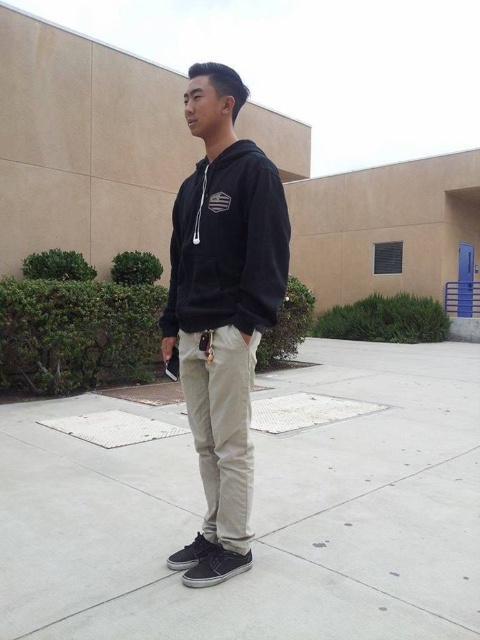
What do you see at coordinates (259, 515) in the screenshot?
I see `concrete at center` at bounding box center [259, 515].

Between point (444, 456) and point (232, 214), which one is positioned in front?

Point (232, 214) is in front.

This screenshot has width=480, height=640. I want to click on concrete at center, so click(259, 515).

Looking at this image, between black cotton hoodie at center and black fleece sweatshirt at center, which one is positioned lower?

black cotton hoodie at center is below.

Is black cotton hoodie at center to the left of black fleece sweatshirt at center from the viewer's perspective?

Yes, black cotton hoodie at center is to the left of black fleece sweatshirt at center.

Where is `black cotton hoodie at center`? The image size is (480, 640). black cotton hoodie at center is located at coordinates (222, 308).

Locate an element on the screen. Image resolution: width=480 pixels, height=640 pixels. black cotton hoodie at center is located at coordinates (222, 308).

Is concrete at center to the left of black cotton hoodie at center from the viewer's perspective?

Yes, concrete at center is to the left of black cotton hoodie at center.

Can you confirm if concrete at center is smaller than black cotton hoodie at center?

Yes, concrete at center is smaller than black cotton hoodie at center.

Which is in front, point (345, 497) or point (204, 547)?

Point (204, 547)

Where is `concrete at center`? concrete at center is located at coordinates (259, 515).